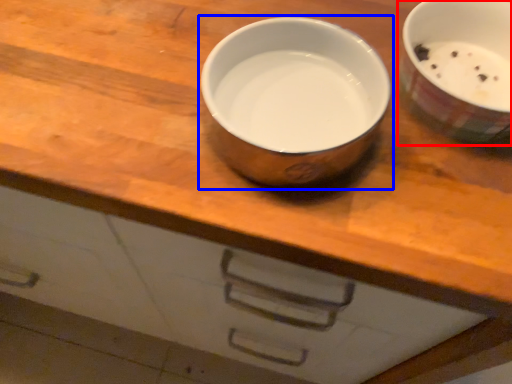
Question: Which of the following is the farthest to the observer, tableware (highlighted by a red box) or tableware (highlighted by a blue box)?

Choices:
 (A) tableware
 (B) tableware

Answer: (A)